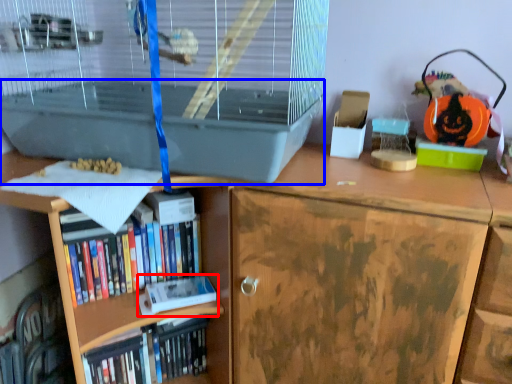
Question: Which object appears farthest to the camera in this image, paperback book (highlighted by a red box) or wide (highlighted by a blue box)?

Choices:
 (A) paperback book
 (B) wide

Answer: (A)